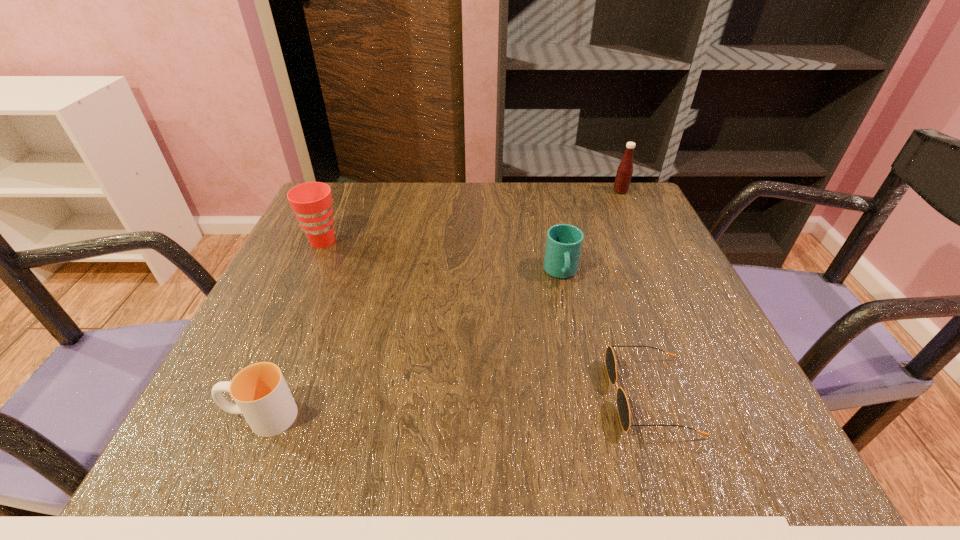
Find the location of `empty location between the tallest cup and the shortest object`. empty location between the tallest cup and the shortest object is located at coordinates pyautogui.click(x=487, y=319).

This screenshot has width=960, height=540. In order to click on free space between the tallest cup and the shortest object in this screenshot , I will do `click(487, 319)`.

Identify which object is the second nearest to the nearest cup. Please provide its 2D coordinates. Your answer should be formatted as a tuple, i.e. [(x, y)], where the tuple contains the x and y coordinates of a point satisfying the conditions above.

[(623, 408)]

Where is `object that ranks as the fourth closest to the third farthest object`? object that ranks as the fourth closest to the third farthest object is located at coordinates (261, 394).

Identify which cup is the nearest to the rightmost cup. Please provide its 2D coordinates. Your answer should be formatted as a tuple, i.e. [(x, y)], where the tuple contains the x and y coordinates of a point satisfying the conditions above.

[(311, 202)]

This screenshot has width=960, height=540. I want to click on cup that is the second closest to the tallest cup, so click(564, 242).

The width and height of the screenshot is (960, 540). I want to click on free point that satisfies the following two spatial constraints: 1. with the handle on the side of the nearest cup; 2. on the right side of the Tabasco sauce, so click(355, 191).